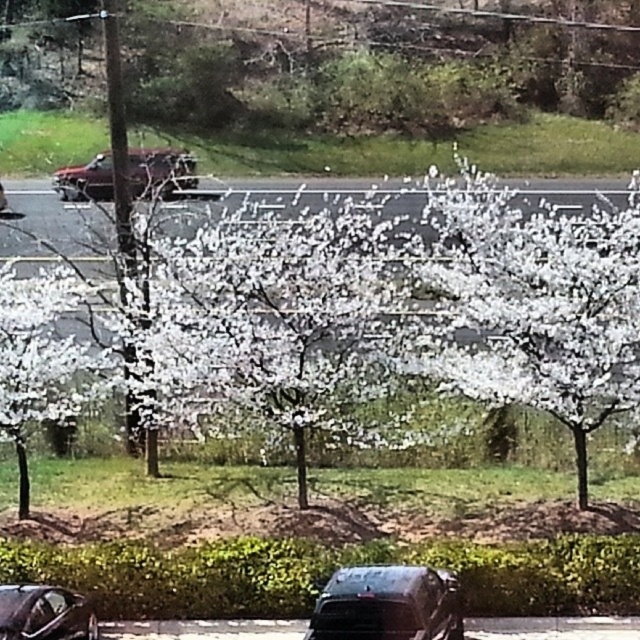
You are a pedestrian standing on the paved road in the scene. You see the white matte tree at center and the dark gray metallic car at lower center. Which object is closer to you?

The white matte tree at center is closer to you because the dark gray metallic car at lower center is behind it.